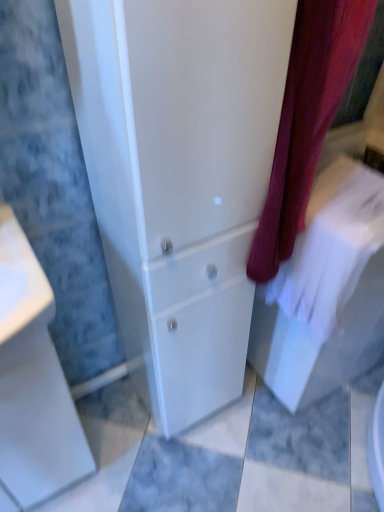
Question: Is point click(21, 268) closer or farther from the camera than point click(269, 155)?

Choices:
 (A) farther
 (B) closer

Answer: (B)

Question: Relative to white glossy cabinet at center, is white glossy porcelain at lower left in front or behind?

Choices:
 (A) front
 (B) behind

Answer: (B)

Question: Estimate the real-world distances between objects in this image. Which object is closer to the white glossy cabinet at center?

Choices:
 (A) velvet burgundy curtain at center
 (B) white cotton bath towel at right
 (C) white glossy porcelain at lower left

Answer: (A)

Question: Based on their relative distances, which object is nearer to the white glossy porcelain at lower left?

Choices:
 (A) white glossy cabinet at center
 (B) velvet burgundy curtain at center
 (C) white cotton bath towel at right

Answer: (A)